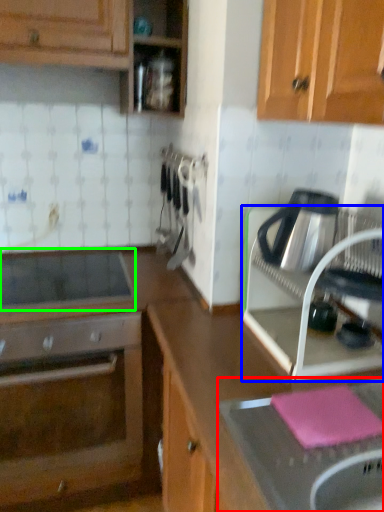
Question: Considering the real-world distances, which object is farthest from sink (highlighted by a red box)? kitchen appliance (highlighted by a blue box) or home appliance (highlighted by a green box)?

Choices:
 (A) kitchen appliance
 (B) home appliance

Answer: (B)